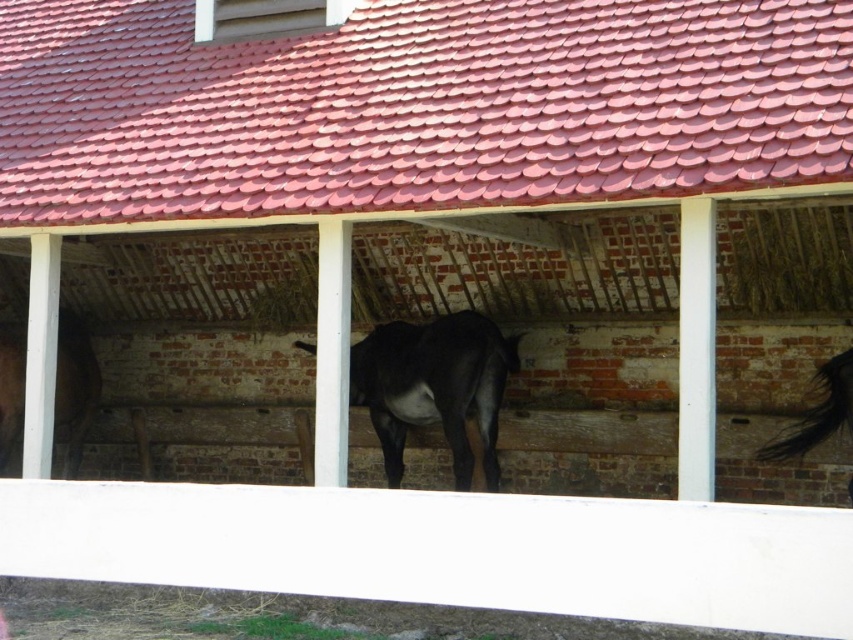
Who is more forward, (413, 387) or (821, 374)?

Point (821, 374) is more forward.

Does black glossy horse at center come behind black glossy horse at right?

Yes.

Which is in front, point (480, 452) or point (766, 458)?

Point (766, 458) is in front.

Where is `black glossy horse at center`? The width and height of the screenshot is (853, 640). black glossy horse at center is located at coordinates (434, 387).

Is dark brown glossy horse at left wider than black glossy horse at right?

Correct, the width of dark brown glossy horse at left exceeds that of black glossy horse at right.

Does dark brown glossy horse at left appear under black glossy horse at right?

Yes.

Where is `dark brown glossy horse at left`? The height and width of the screenshot is (640, 853). dark brown glossy horse at left is located at coordinates click(74, 385).

At what (x,y) coordinates should I click in order to perform the action: click on dark brown glossy horse at left. Please return your answer as a coordinate pair (x, y). Looking at the image, I should click on (74, 385).

Looking at this image, does black glossy horse at center have a lesser height compared to dark brown glossy horse at left?

Yes.

What do you see at coordinates (434, 387) in the screenshot? I see `black glossy horse at center` at bounding box center [434, 387].

Looking at this image, who is more distant from viewer, (480,317) or (91,376)?

The point (91,376) is more distant.

The width and height of the screenshot is (853, 640). In order to click on black glossy horse at center in this screenshot , I will do `click(434, 387)`.